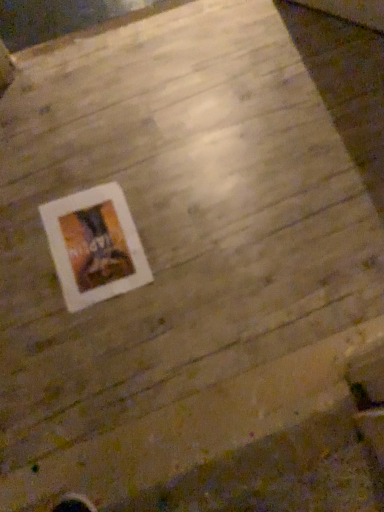
The width and height of the screenshot is (384, 512). In order to click on free space in front of white matte picture frame at center in this screenshot , I will do `click(104, 339)`.